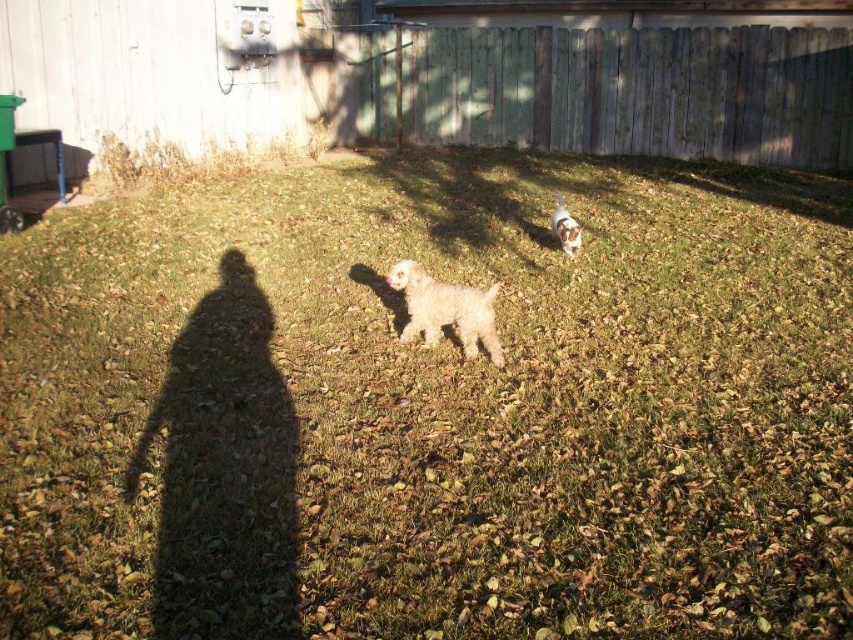
Question: Based on their relative distances, which object is nearer to the white fluffy dog at center?

Choices:
 (A) weathered wood fence at upper center
 (B) white fluffy dog at upper right

Answer: (B)

Question: Which object appears farthest from the camera in this image?

Choices:
 (A) white fluffy dog at upper right
 (B) weathered wood fence at upper center
 (C) white fluffy dog at center

Answer: (B)

Question: Is weathered wood fence at upper center closer to the viewer compared to white fluffy dog at upper right?

Choices:
 (A) yes
 (B) no

Answer: (B)

Question: Is white fluffy dog at center thinner than white fluffy dog at upper right?

Choices:
 (A) no
 (B) yes

Answer: (A)

Question: Is white fluffy dog at center positioned in front of white fluffy dog at upper right?

Choices:
 (A) no
 (B) yes

Answer: (B)

Question: Considering the real-world distances, which object is closest to the white fluffy dog at center?

Choices:
 (A) white fluffy dog at upper right
 (B) weathered wood fence at upper center

Answer: (A)